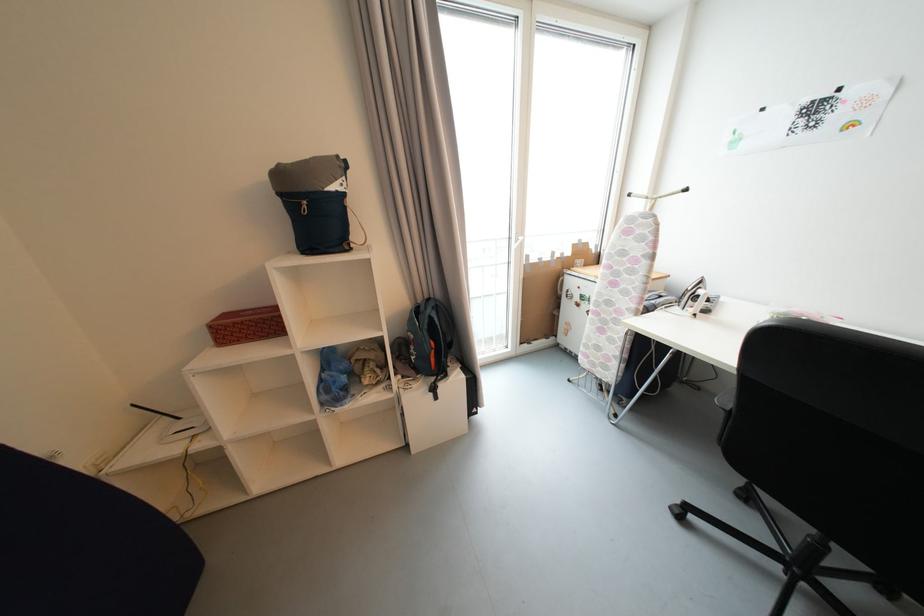
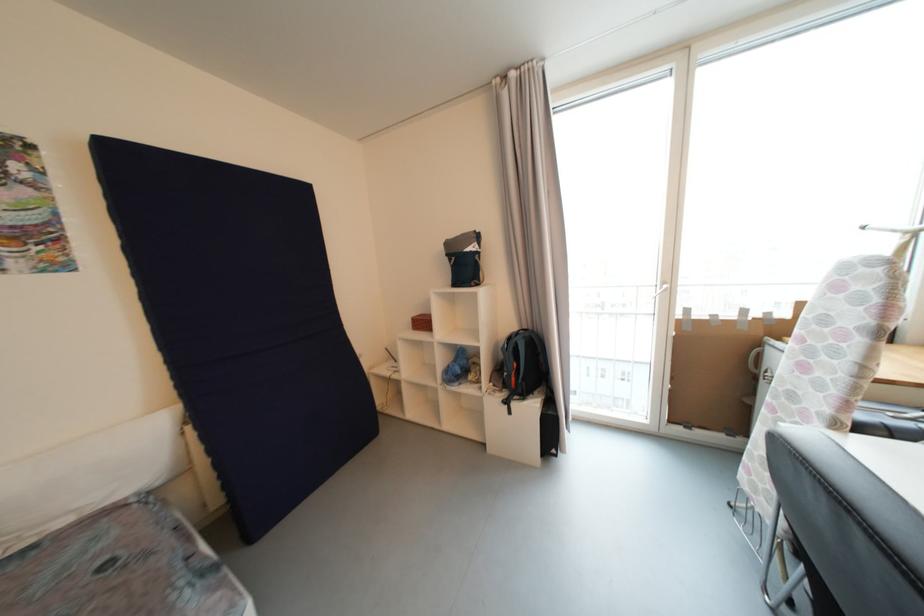
Question: The images are taken continuously from a first-person perspective. In which direction is your viewpoint rotating?

Choices:
 (A) Left
 (B) Right
 (C) Up
 (D) Down

Answer: (A)